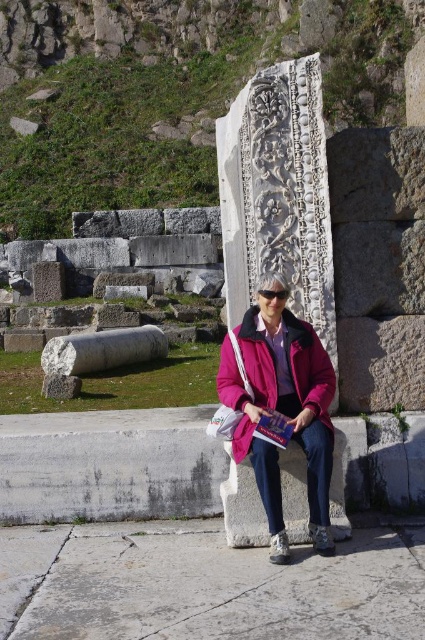
Question: Can you confirm if carved stone column at center is smaller than pink fabric jacket at center?

Choices:
 (A) no
 (B) yes

Answer: (A)

Question: Is carved stone column at center to the right of pink fabric jacket at center from the viewer's perspective?

Choices:
 (A) yes
 (B) no

Answer: (B)

Question: Can you confirm if carved stone column at center is positioned to the right of pink fabric jacket at center?

Choices:
 (A) no
 (B) yes

Answer: (A)

Question: Which point is closer to the camera?

Choices:
 (A) carved stone column at center
 (B) pink fabric jacket at center

Answer: (B)

Question: Which object is closer to the camera taking this photo?

Choices:
 (A) pink fabric jacket at center
 (B) carved stone column at center

Answer: (A)